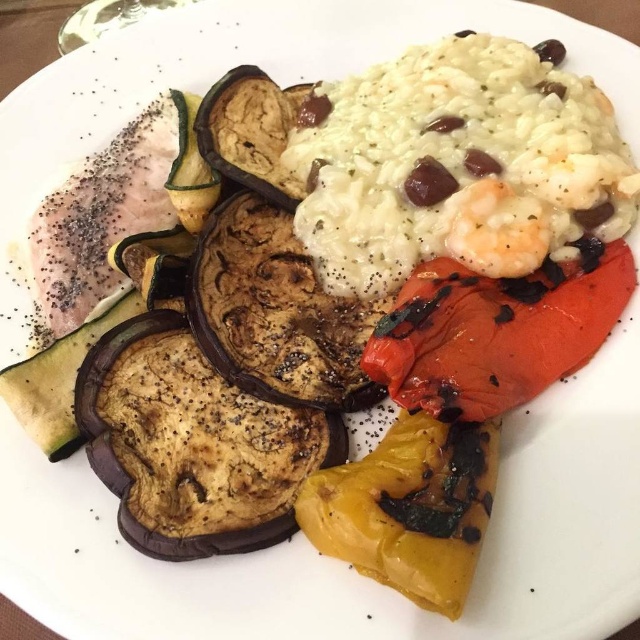
Question: Where is white creamy rice at upper right located in relation to yellow charred pepper at lower center in the image?

Choices:
 (A) above
 (B) below

Answer: (A)

Question: Is white creamy rice at upper right wider than charred red pepper at right?

Choices:
 (A) yes
 (B) no

Answer: (A)

Question: Which object appears farthest from the camera in this image?

Choices:
 (A) charred red pepper at right
 (B) white creamy rice at upper right

Answer: (B)

Question: Does white creamy rice at upper right have a lesser width compared to charred red pepper at right?

Choices:
 (A) yes
 (B) no

Answer: (B)

Question: Which of the following is the closest to the observer?

Choices:
 (A) (404, 291)
 (B) (483, 259)

Answer: (B)

Question: Which is nearer to the white creamy rice at upper right?

Choices:
 (A) charred red pepper at right
 (B) yellow charred pepper at lower center

Answer: (A)